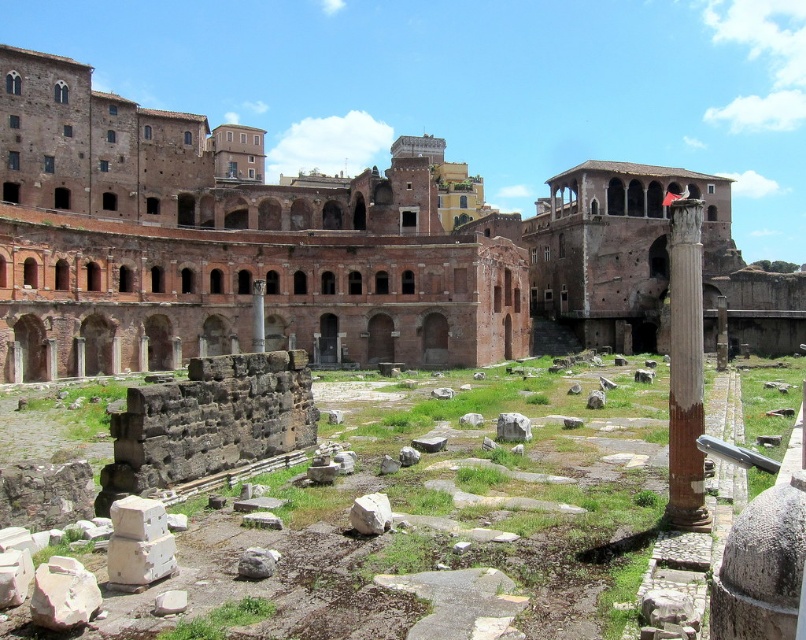
Question: From the image, what is the correct spatial relationship of rustic stone ruins at center in relation to smooth stone column at right?

Choices:
 (A) above
 (B) below

Answer: (B)

Question: Among these objects, which one is nearest to the camera?

Choices:
 (A) rustic stone ruins at center
 (B) reddish-brown stone ruins at center

Answer: (A)

Question: Can you confirm if rustic stone ruins at center is positioned above smooth stone column at right?

Choices:
 (A) no
 (B) yes

Answer: (A)

Question: Can you confirm if rustic stone ruins at center is wider than smooth stone column at right?

Choices:
 (A) no
 (B) yes

Answer: (B)

Question: Estimate the real-world distances between objects in this image. Which object is farther from the rustic stone ruins at center?

Choices:
 (A) smooth stone column at right
 (B) reddish-brown stone ruins at center

Answer: (B)

Question: Which point is farther from the camera taking this photo?

Choices:
 (A) (401, 531)
 (B) (331, 273)
 (C) (678, 476)

Answer: (B)